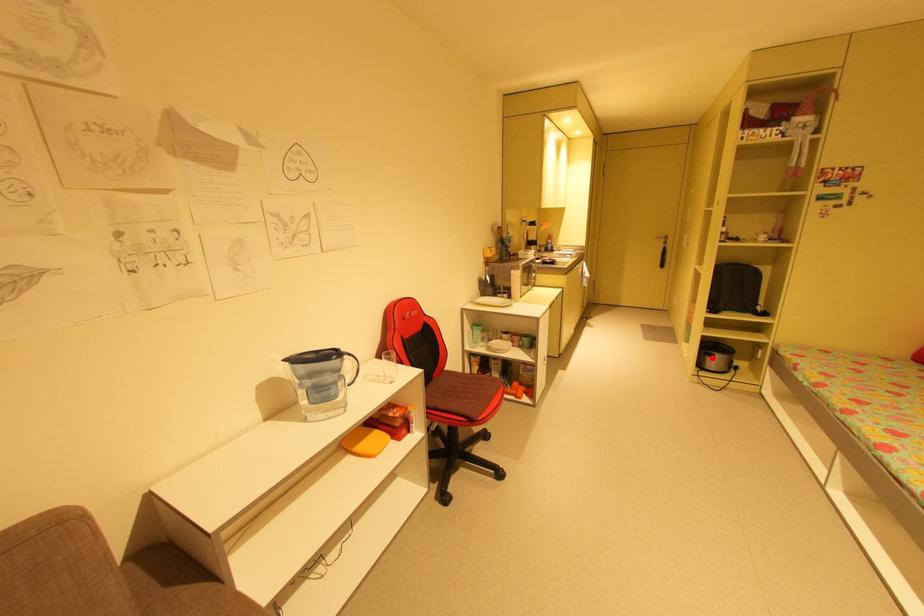
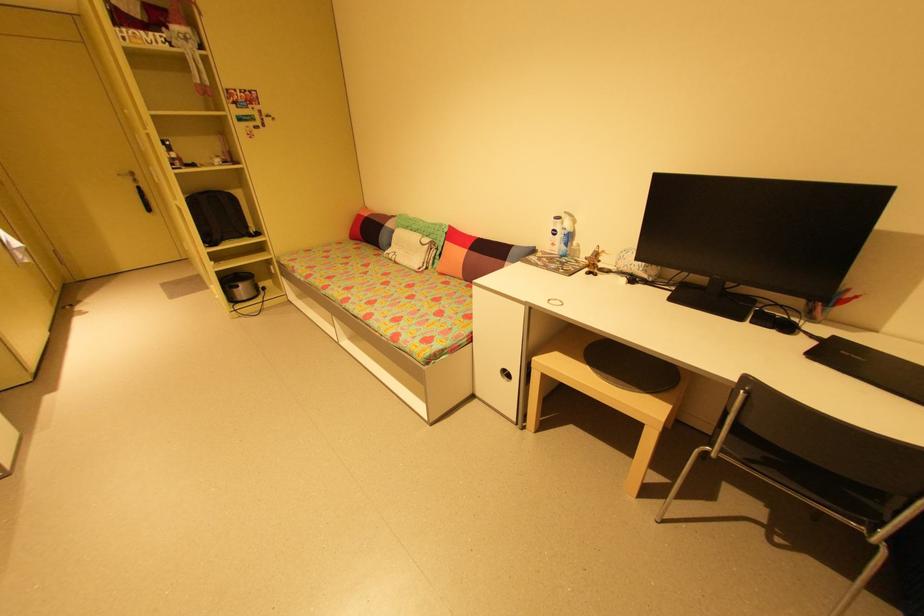
Locate, in the second image, the point that corresponds to the highlighted location in the first image.

(239, 291)